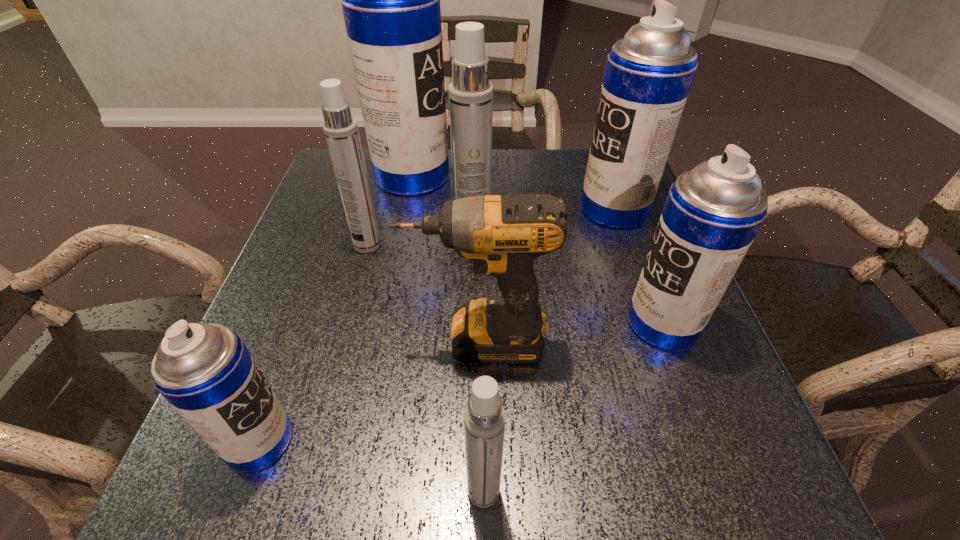
Image resolution: width=960 pixels, height=540 pixels. I want to click on free space between the second biggest blue aerosol can and the drill, so click(x=545, y=274).

Where is `free spot between the third nearest aerosol can and the sixth farthest aerosol can`? free spot between the third nearest aerosol can and the sixth farthest aerosol can is located at coordinates (461, 381).

Identify the location of free space between the second nearest blue aerosol can and the drill. This screenshot has height=540, width=960. (570, 331).

Identify which object is located as the third nearest to the third smallest blue aerosol can. Please provide its 2D coordinates. Your answer should be formatted as a tuple, i.e. [(x, y)], where the tuple contains the x and y coordinates of a point satisfying the conditions above.

[(503, 235)]

Select which object is the third closest to the second smallest blue aerosol can. Please provide its 2D coordinates. Your answer should be formatted as a tuple, i.e. [(x, y)], where the tuple contains the x and y coordinates of a point satisfying the conditions above.

[(470, 93)]

You are a GUI agent. You are given a task and a screenshot of the screen. Output one action in this format:
    pyautogui.click(x=<x>, y=<y>)
    Task: Click on the aerosol can identified as the fourth closest to the tallest aerosol can
    
    Given the screenshot: What is the action you would take?
    pyautogui.click(x=713, y=212)

Select which aerosol can appears as the fifth closest to the leftmost aerosol can. Please provide its 2D coordinates. Your answer should be formatted as a tuple, i.e. [(x, y)], where the tuple contains the x and y coordinates of a point satisfying the conditions above.

[(390, 0)]

This screenshot has width=960, height=540. Identify the location of blue aerosol can that stands as the closest to the second nearest aerosol can. (713, 212).

Locate an element on the screen. The width and height of the screenshot is (960, 540). the second closest blue aerosol can to the second biggest blue aerosol can is located at coordinates (390, 0).

Locate which white aerosol can ranks second in proximity to the biggest blue aerosol can. Please provide its 2D coordinates. Your answer should be formatted as a tuple, i.e. [(x, y)], where the tuple contains the x and y coordinates of a point satisfying the conditions above.

[(470, 93)]